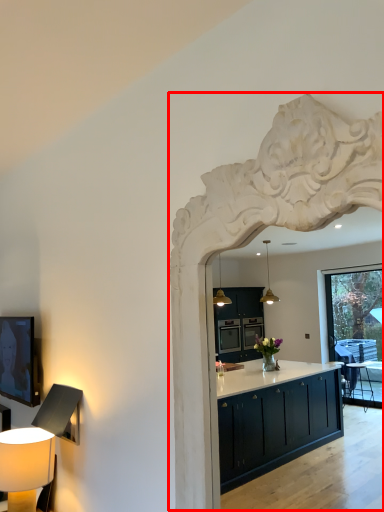
Question: Observing the image, what is the correct spatial positioning of archway (annotated by the red box) in reference to table lamp?

Choices:
 (A) left
 (B) right

Answer: (B)